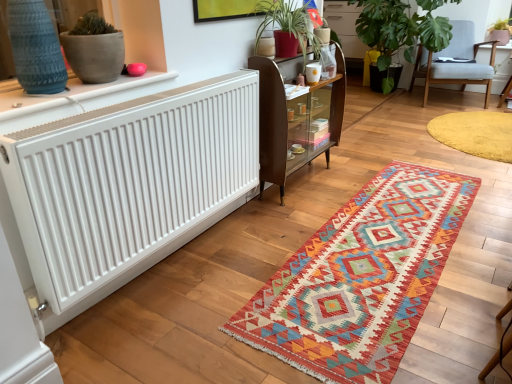
Question: From the image's perspective, is yellow plush rug at lower right, positioned as the second mat in front-to-back order, under pink matte pot at upper right, which ranks as the 1th houseplant in right-to-left order?

Choices:
 (A) yes
 (B) no

Answer: (A)

Question: Is yellow plush rug at lower right, which is the 1th mat from top to bottom, to the right of pink matte pot at upper right, which is counted as the 2th houseplant, starting from the left, from the viewer's perspective?

Choices:
 (A) no
 (B) yes

Answer: (A)

Question: Does yellow plush rug at lower right, which is the 1th mat from top to bottom, have a greater height compared to pink matte pot at upper right, which is counted as the 2th houseplant, starting from the left?

Choices:
 (A) yes
 (B) no

Answer: (B)

Question: Is yellow plush rug at lower right, which is the 1th mat from top to bottom, thinner than pink matte pot at upper right, which is counted as the 2th houseplant, starting from the left?

Choices:
 (A) no
 (B) yes

Answer: (A)

Question: From the image's perspective, is yellow plush rug at lower right, placed as the first mat when sorted from right to left, on pink matte pot at upper right, which is counted as the 2th houseplant, starting from the left?

Choices:
 (A) yes
 (B) no

Answer: (B)

Question: Considering the relative sizes of yellow plush rug at lower right, placed as the first mat when sorted from right to left, and pink matte pot at upper right, which ranks as the 1th houseplant in right-to-left order, in the image provided, is yellow plush rug at lower right, placed as the first mat when sorted from right to left, wider than pink matte pot at upper right, which ranks as the 1th houseplant in right-to-left order,?

Choices:
 (A) yes
 (B) no

Answer: (A)

Question: Is white textured radiator at upper left taller than wooden glass-fronted cabinet at center?

Choices:
 (A) yes
 (B) no

Answer: (B)

Question: From the image's perspective, is white textured radiator at upper left beneath wooden glass-fronted cabinet at center?

Choices:
 (A) yes
 (B) no

Answer: (A)

Question: Is white textured radiator at upper left further to camera compared to wooden glass-fronted cabinet at center?

Choices:
 (A) yes
 (B) no

Answer: (B)

Question: Does white textured radiator at upper left turn towards wooden glass-fronted cabinet at center?

Choices:
 (A) no
 (B) yes

Answer: (A)

Question: Is white textured radiator at upper left closer to camera compared to wooden glass-fronted cabinet at center?

Choices:
 (A) no
 (B) yes

Answer: (B)

Question: Is wooden glass-fronted cabinet at center at the back of white textured radiator at upper left?

Choices:
 (A) no
 (B) yes

Answer: (A)

Question: Is the surface of knitted woolen rug at center, which ranks as the first mat in front-to-back order, in direct contact with green leafy plant at upper right, the 2th houseplant when ordered from right to left?

Choices:
 (A) no
 (B) yes

Answer: (A)